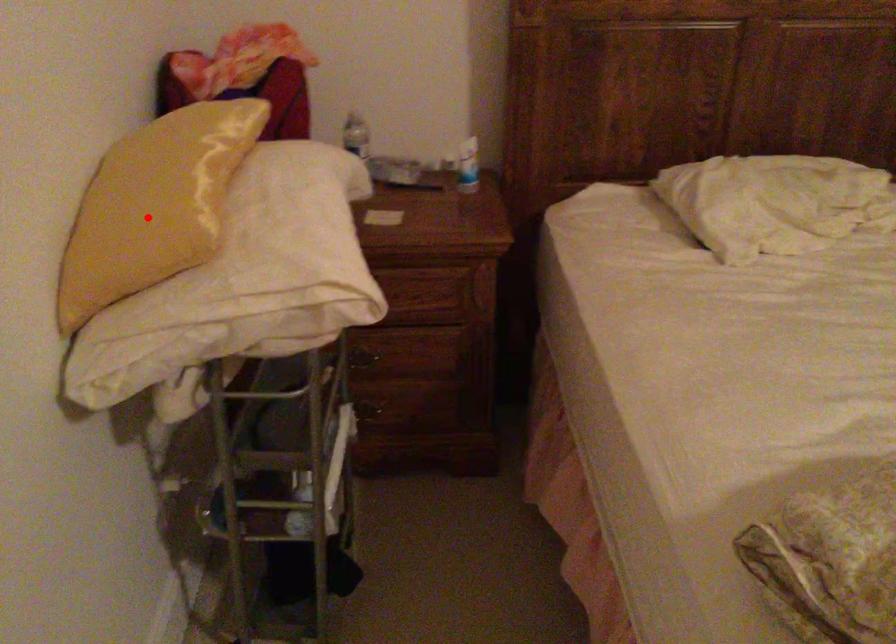
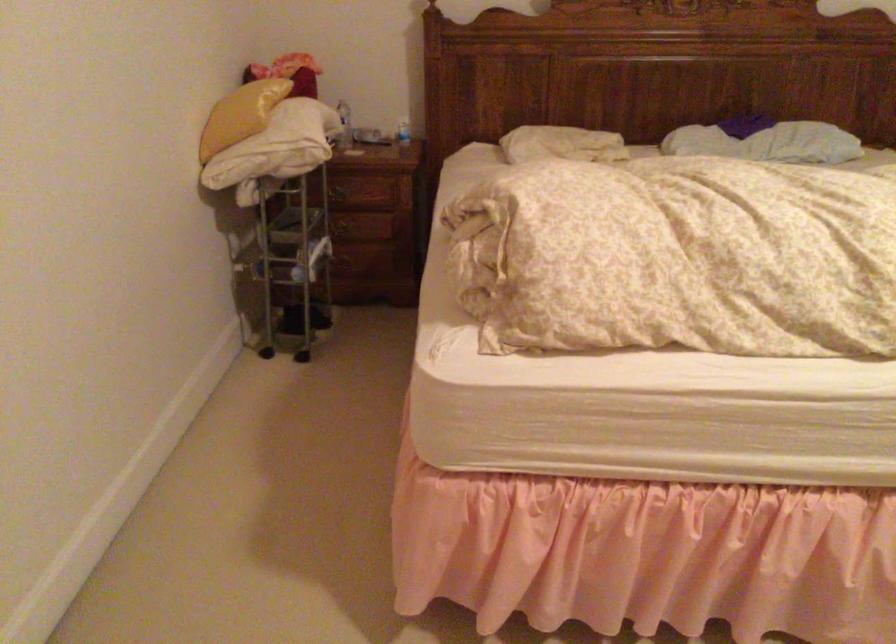
Question: I am providing you with two images of the same scene from different viewpoints. A red point is shown in image1. For the corresponding object point in image2, is it positioned nearer or farther from the camera?

Choices:
 (A) Nearer
 (B) Farther

Answer: (B)